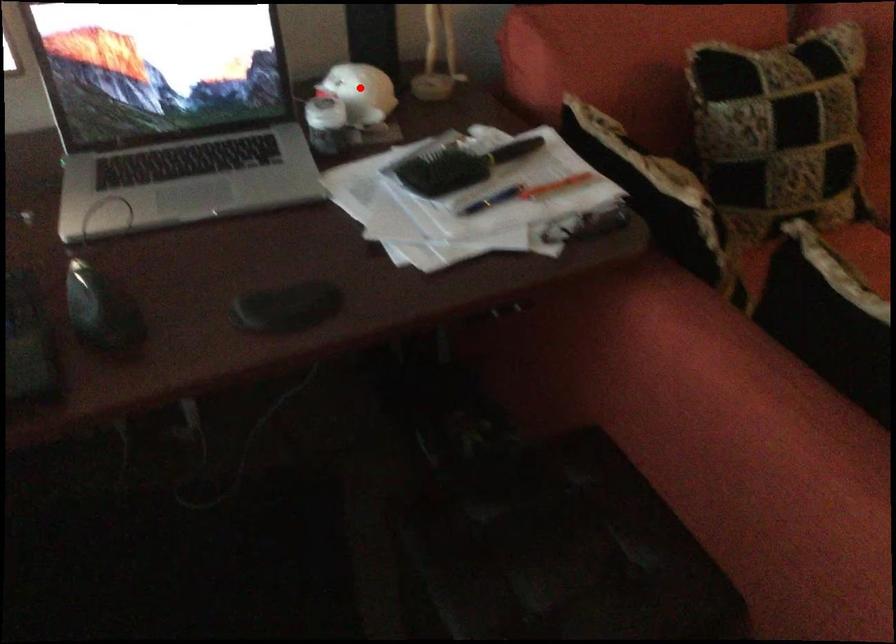
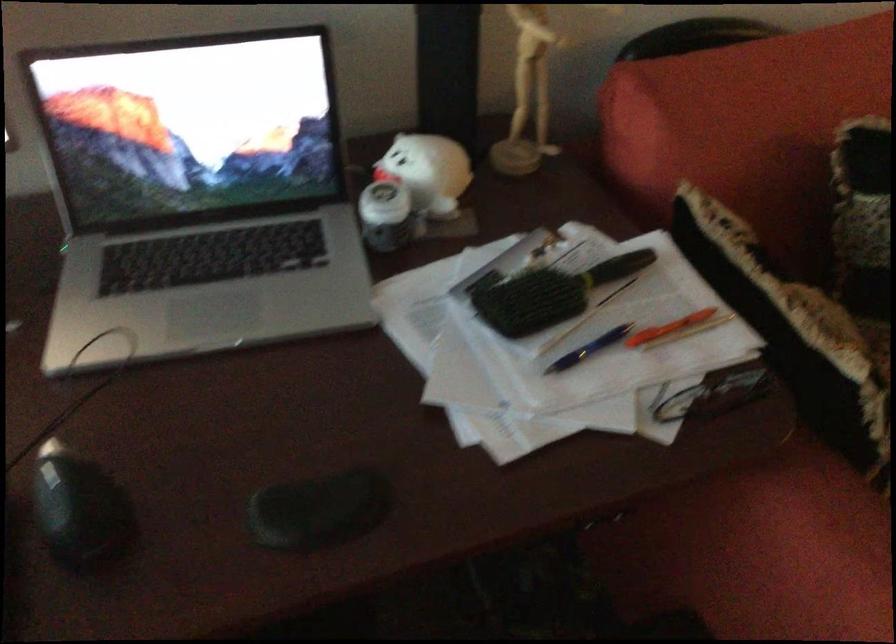
The point at the highlighted location is marked in the first image. Where is the corresponding point in the second image?

(428, 172)